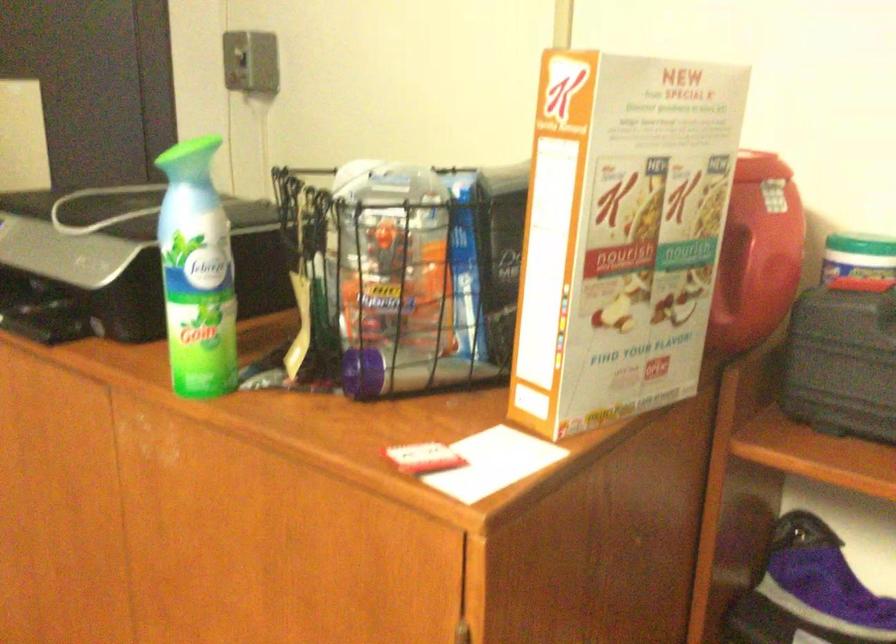
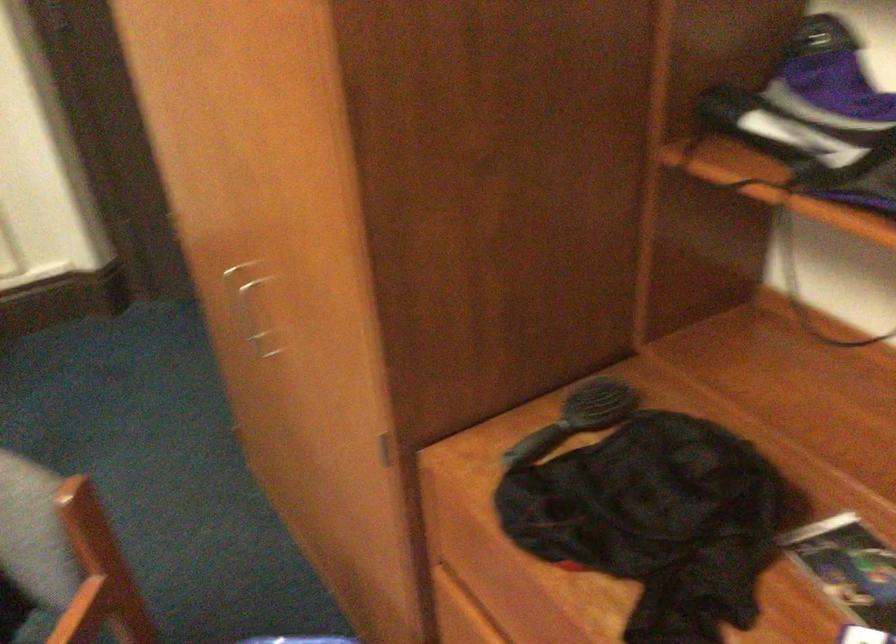
The first image is from the beginning of the video and the second image is from the end. How did the camera likely rotate when shooting the video?

The camera's rotation is toward left-down.